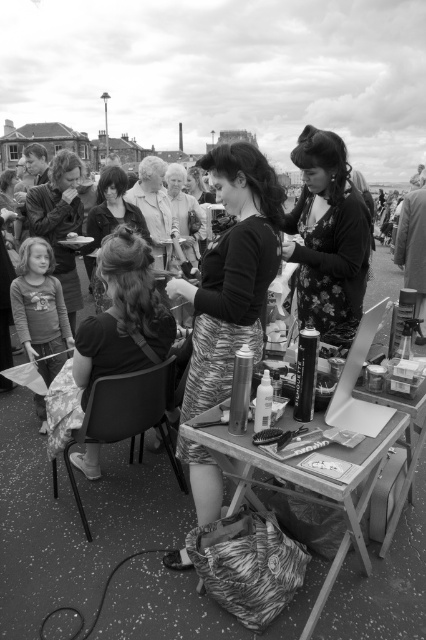
You are a photographer at the event and want to capture a clear shot of both the matte black shirt at center and the matte black jacket at center. Since they are both black, you need to adjust your camera settings to focus on their positions. Based on their arrangement, which one is closer to the camera?

The matte black shirt at center is positioned under the matte black jacket at center, so the jacket is closer to the camera than the shirt.

You are a photographer at the event and want to capture a photo that includes both the matte black hair at center and the matte gray sweater at center. Based on their positions, which object should you ensure is placed to the left in your camera frame?

The matte black hair at center is to the left of the matte gray sweater at center, so in the photo, the matte black hair at center should be positioned to the left of the matte gray sweater at center to accurately reflect their arrangement.

You are a photographer at the event and want to capture a closeup of both the matte black shirt at center and the matte black jacket at center. Since you can only focus on one object at a time, which one should you choose to ensure the other is still somewhat in focus?

The matte black shirt at center is shorter than the matte black jacket at center, so focusing on the matte black jacket at center would keep the shirt in better focus since it is closer in distance to the camera.